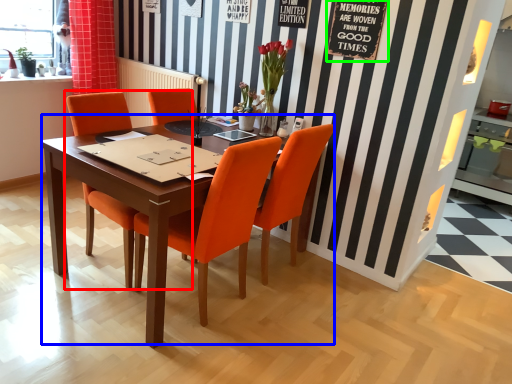
Question: Considering the real-world distances, which object is closest to chair (highlighted by a red box)? kitchen & dining room table (highlighted by a blue box) or bulletin board (highlighted by a green box).

Choices:
 (A) kitchen & dining room table
 (B) bulletin board

Answer: (A)